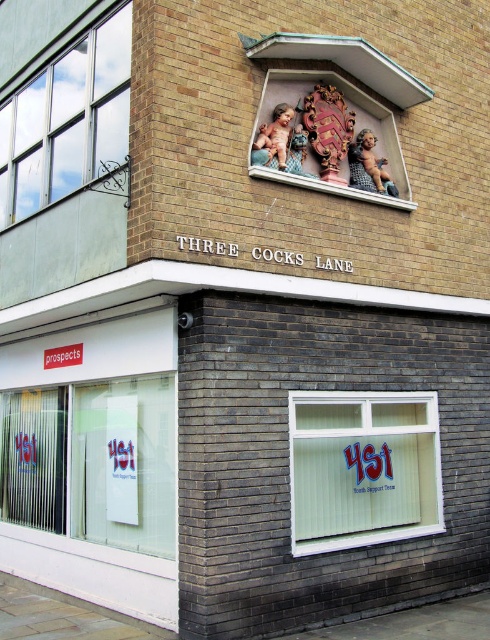
Question: Is white plastic shop window at lower right to the right of metallic glass window at upper left from the viewer's perspective?

Choices:
 (A) yes
 (B) no

Answer: (A)

Question: From the image, what is the correct spatial relationship of transparent glass shop window at lower left in relation to metallic glass window at upper left?

Choices:
 (A) below
 (B) above

Answer: (A)

Question: Estimate the real-world distances between objects in this image. Which object is farther from the white plastic shop window at lower right?

Choices:
 (A) transparent glass shop window at lower left
 (B) metallic glass window at upper left

Answer: (B)

Question: Which point appears farthest from the camera in this image?

Choices:
 (A) (143, 448)
 (B) (92, 129)

Answer: (B)

Question: Where is transparent glass shop window at lower left located in relation to white plastic shop window at lower right in the image?

Choices:
 (A) below
 (B) above

Answer: (A)

Question: Based on their relative distances, which object is nearer to the metallic glass window at upper left?

Choices:
 (A) transparent glass shop window at lower left
 (B) white plastic shop window at lower right

Answer: (A)